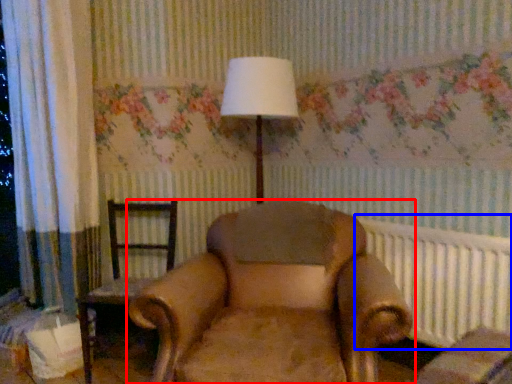
Question: Which of the following is the farthest to the observer, chair (highlighted by a red box) or radiator (highlighted by a blue box)?

Choices:
 (A) chair
 (B) radiator

Answer: (B)